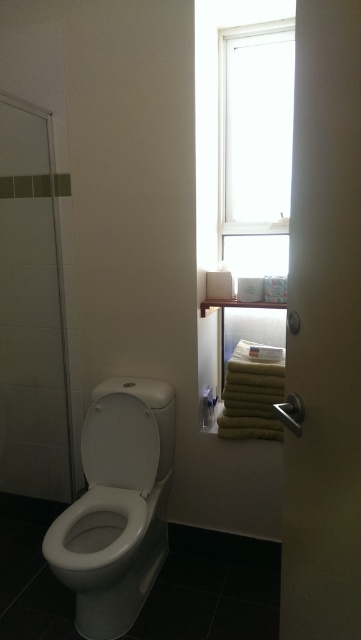
Question: Which is nearer to the white glossy toilet lid at center?

Choices:
 (A) transparent glass shower door at left
 (B) brushed metal shower at lower right

Answer: (A)

Question: Which object is the farthest from the transparent glass door at center?

Choices:
 (A) brushed metal shower at lower right
 (B) transparent glass window at upper center
 (C) white glossy toilet lid at center

Answer: (B)

Question: Which point is closer to the camera taking this photo?

Choices:
 (A) (45, 332)
 (B) (332, 376)
 (C) (251, 33)

Answer: (B)

Question: Is white glossy toilet at lower left smaller than brushed metal shower at lower right?

Choices:
 (A) yes
 (B) no

Answer: (B)

Question: Is white glossy toilet at lower left further to the viewer compared to white glossy toilet lid at center?

Choices:
 (A) yes
 (B) no

Answer: (B)

Question: Does transparent glass window at upper center have a smaller size compared to white glossy toilet lid at center?

Choices:
 (A) yes
 (B) no

Answer: (B)